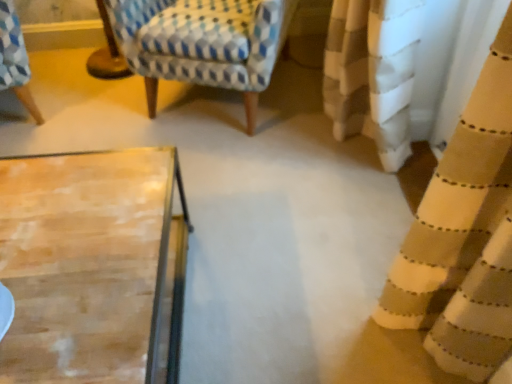
Question: Considering the relative sizes of beige textured curtain at right and patterned fabric rocking chair at upper left in the image provided, is beige textured curtain at right wider than patterned fabric rocking chair at upper left?

Choices:
 (A) yes
 (B) no

Answer: (B)

Question: Is the depth of beige textured curtain at right less than that of patterned fabric rocking chair at upper left?

Choices:
 (A) yes
 (B) no

Answer: (A)

Question: Considering the relative positions of beige textured curtain at right and patterned fabric rocking chair at upper left in the image provided, is beige textured curtain at right to the right of patterned fabric rocking chair at upper left from the viewer's perspective?

Choices:
 (A) no
 (B) yes

Answer: (B)

Question: Is beige textured curtain at right touching patterned fabric rocking chair at upper left?

Choices:
 (A) no
 (B) yes

Answer: (A)

Question: Is beige textured curtain at right looking in the opposite direction of patterned fabric rocking chair at upper left?

Choices:
 (A) no
 (B) yes

Answer: (A)

Question: From the image's perspective, is beige textured curtain at right located beneath patterned fabric rocking chair at upper left?

Choices:
 (A) no
 (B) yes

Answer: (B)

Question: Does patterned fabric rocking chair at upper left appear on the right side of beige textured curtain at right?

Choices:
 (A) no
 (B) yes

Answer: (A)

Question: Is patterned fabric rocking chair at upper left aimed at beige textured curtain at right?

Choices:
 (A) no
 (B) yes

Answer: (A)

Question: Is patterned fabric rocking chair at upper left not near beige textured curtain at right?

Choices:
 (A) yes
 (B) no

Answer: (A)

Question: Considering the relative sizes of patterned fabric rocking chair at upper left and beige textured curtain at right in the image provided, is patterned fabric rocking chair at upper left shorter than beige textured curtain at right?

Choices:
 (A) no
 (B) yes

Answer: (B)

Question: Is patterned fabric rocking chair at upper left not within beige textured curtain at right?

Choices:
 (A) no
 (B) yes

Answer: (B)

Question: Does patterned fabric rocking chair at upper left have a greater height compared to beige textured curtain at right?

Choices:
 (A) no
 (B) yes

Answer: (A)

Question: Considering the positions of beige textured curtain at right and patterned fabric rocking chair at upper left in the image, is beige textured curtain at right taller or shorter than patterned fabric rocking chair at upper left?

Choices:
 (A) short
 (B) tall

Answer: (B)